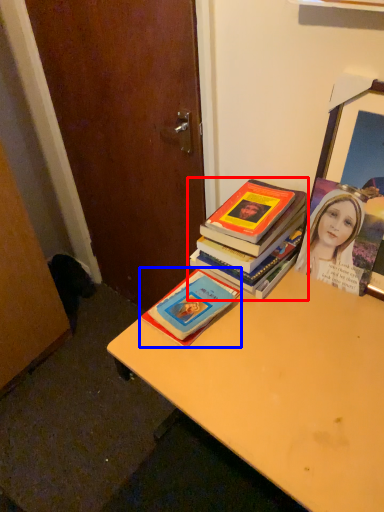
Question: Which object appears closest to the camera in this image, book (highlighted by a red box) or book (highlighted by a blue box)?

Choices:
 (A) book
 (B) book

Answer: (B)